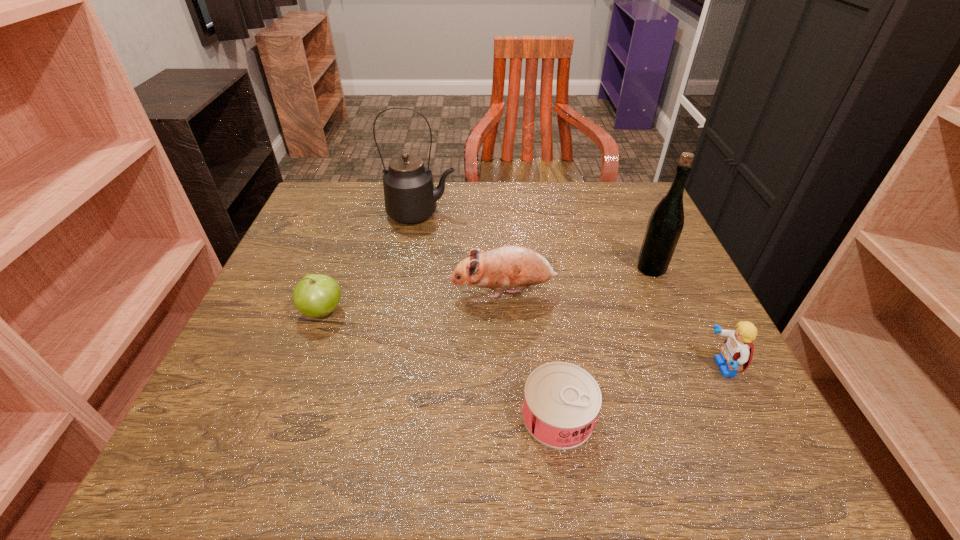
Locate an element on the screen. free area in between the can and the beer bottle is located at coordinates (605, 342).

Locate an element on the screen. vacant region between the hamster and the shortest object is located at coordinates (531, 353).

The image size is (960, 540). Identify the location of free spot between the apple and the beer bottle. (487, 290).

At what (x,y) coordinates should I click in order to perform the action: click on vacant area that lies between the nearest object and the fifth farthest object. Please return your answer as a coordinate pair (x, y). Looking at the image, I should click on (640, 392).

Identify the location of vacant area that lies between the can and the farthest object. The image size is (960, 540). (490, 314).

Locate an element on the screen. Image resolution: width=960 pixels, height=540 pixels. unoccupied area between the hamster and the apple is located at coordinates (413, 301).

Locate an element on the screen. Image resolution: width=960 pixels, height=540 pixels. vacant area that lies between the kettle and the hamster is located at coordinates (463, 252).

The image size is (960, 540). Identify the location of vacant point located between the Lego and the shortest object. (640, 392).

This screenshot has height=540, width=960. Find the location of `free spot between the beer bottle and the hamster`. free spot between the beer bottle and the hamster is located at coordinates (577, 280).

In order to click on the third closest object to the hamster in this screenshot , I will do `click(561, 403)`.